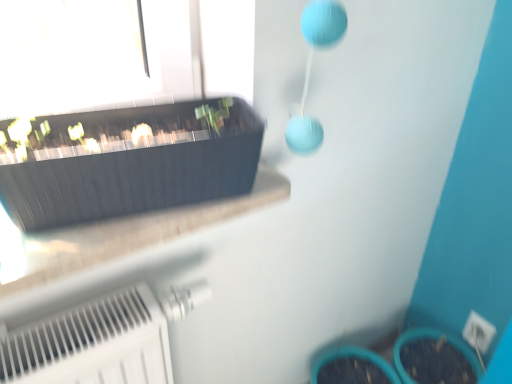
Question: Considering the relative positions of white plastic electric outlet at lower right and matte black flowerpot at upper left in the image provided, is white plastic electric outlet at lower right to the left or to the right of matte black flowerpot at upper left?

Choices:
 (A) left
 (B) right

Answer: (B)

Question: Is white plastic electric outlet at lower right inside the boundaries of matte black flowerpot at upper left, or outside?

Choices:
 (A) inside
 (B) outside

Answer: (B)

Question: From a real-world perspective, is white plastic electric outlet at lower right physically located above or below matte black flowerpot at upper left?

Choices:
 (A) below
 (B) above

Answer: (A)

Question: Is matte black flowerpot at upper left inside the boundaries of white plastic electric outlet at lower right, or outside?

Choices:
 (A) inside
 (B) outside

Answer: (B)

Question: Is matte black flowerpot at upper left wider or thinner than white plastic electric outlet at lower right?

Choices:
 (A) thin
 (B) wide

Answer: (B)

Question: In the image, is matte black flowerpot at upper left positioned in front of or behind white plastic electric outlet at lower right?

Choices:
 (A) front
 (B) behind

Answer: (A)

Question: From a real-world perspective, relative to white plastic electric outlet at lower right, is matte black flowerpot at upper left vertically above or below?

Choices:
 (A) above
 (B) below

Answer: (A)